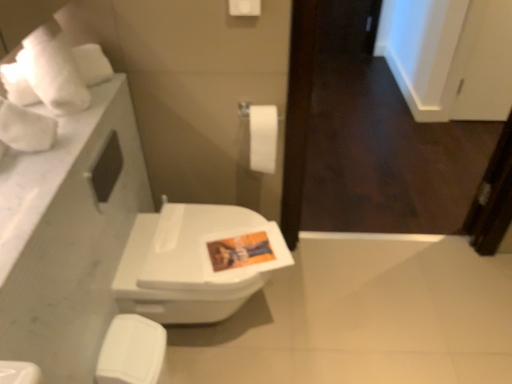
What is the approximate height of white matte toilet paper at center?

white matte toilet paper at center is 11.52 inches in height.

Image resolution: width=512 pixels, height=384 pixels. What do you see at coordinates (263, 137) in the screenshot?
I see `white matte toilet paper at center` at bounding box center [263, 137].

Image resolution: width=512 pixels, height=384 pixels. What do you see at coordinates (132, 351) in the screenshot?
I see `white glossy toilet seat at lower left` at bounding box center [132, 351].

Where is `white matte toilet paper at center`? The image size is (512, 384). white matte toilet paper at center is located at coordinates (263, 137).

Does white matte toilet paper at center have a greater height compared to white glossy toilet at center?

Incorrect, the height of white matte toilet paper at center is not larger of that of white glossy toilet at center.

Based on the photo, is white matte toilet paper at center positioned before white glossy toilet at center?

No, the depth of white matte toilet paper at center is greater than that of white glossy toilet at center.

What's the angular difference between white matte toilet paper at center and white glossy toilet at center's facing directions?

89.8 degrees separate the facing orientations of white matte toilet paper at center and white glossy toilet at center.

This screenshot has width=512, height=384. Identify the location of toilet paper that appears on the right of white glossy toilet seat at lower left. (263, 137).

Is white matte toilet paper at center positioned with its back to white glossy toilet seat at lower left?

No, white matte toilet paper at center is not facing away from white glossy toilet seat at lower left.

Considering the sizes of objects white matte toilet paper at center and white glossy toilet seat at lower left in the image provided, who is thinner, white matte toilet paper at center or white glossy toilet seat at lower left?

white matte toilet paper at center.

Is white glossy toilet seat at lower left completely or partially inside white matte toilet paper at center?

Answer: No, white matte toilet paper at center does not contain white glossy toilet seat at lower left.

From the image's perspective, does white glossy toilet at center appear higher than white marble countertop at left?

No, from the image's perspective, white glossy toilet at center is not over white marble countertop at left.

I want to click on counter top in front of the white glossy toilet at center, so click(69, 235).

Does white glossy toilet at center have a greater height compared to white marble countertop at left?

Indeed, white glossy toilet at center has a greater height compared to white marble countertop at left.

Is white glossy toilet at center next to white marble countertop at left?

No, white glossy toilet at center is not with white marble countertop at left.

Is white marble countertop at left surrounding white matte toilet paper at center?

No, white matte toilet paper at center is not surrounded by white marble countertop at left.

From the image's perspective, which one is positioned higher, white marble countertop at left or white matte toilet paper at center?

From the image's view, white matte toilet paper at center is above.

In terms of height, does white marble countertop at left look taller or shorter compared to white matte toilet paper at center?

white marble countertop at left is shorter than white matte toilet paper at center.

Could you tell me if white marble countertop at left is turned towards white glossy toilet at center?

No.

Which of these two, white marble countertop at left or white glossy toilet at center, is wider?

white glossy toilet at center.

Identify the location of toilet behind the white marble countertop at left. Image resolution: width=512 pixels, height=384 pixels. (193, 263).

In the scene shown: Between white glossy toilet at center and white glossy toilet seat at lower left, which one has more height?

With more height is white glossy toilet at center.

Is white glossy toilet at center inside the boundaries of white glossy toilet seat at lower left, or outside?

white glossy toilet at center lies outside white glossy toilet seat at lower left.

From the image's perspective, who appears lower, white glossy toilet at center or white glossy toilet seat at lower left?

white glossy toilet seat at lower left, from the image's perspective.

Is white glossy toilet at center not close to white glossy toilet seat at lower left?

That's not correct — white glossy toilet at center is a little close to white glossy toilet seat at lower left.

Does point (139, 378) come behind point (174, 257)?

No, (139, 378) is in front of (174, 257).

This screenshot has height=384, width=512. Find the location of `toilet behind the white glossy toilet seat at lower left`. toilet behind the white glossy toilet seat at lower left is located at coordinates (193, 263).

Is white glossy toilet at center at the back of white glossy toilet seat at lower left?

white glossy toilet seat at lower left does not have its back to white glossy toilet at center.

Where is `toilet to the left of white matte toilet paper at center`? toilet to the left of white matte toilet paper at center is located at coordinates (193, 263).

Identify the location of porcelain below the white matte toilet paper at center (from the image's perspective). (132, 351).

Estimate the real-world distances between objects in this image. Which object is further from white glossy toilet seat at lower left, white matte toilet paper at center or white marble countertop at left?

Among the two, white matte toilet paper at center is located further to white glossy toilet seat at lower left.

Considering their positions, is white marble countertop at left positioned closer to white glossy toilet seat at lower left than white glossy toilet at center?

Among the two, white glossy toilet at center is located nearer to white glossy toilet seat at lower left.

Which object lies nearer to the anchor point white matte toilet paper at center, white marble countertop at left or white glossy toilet at center?

white glossy toilet at center.

Consider the image. Estimate the real-world distances between objects in this image. Which object is closer to white matte toilet paper at center, white glossy toilet seat at lower left or white glossy toilet at center?

The object closer to white matte toilet paper at center is white glossy toilet at center.

Based on their spatial positions, is white glossy toilet seat at lower left or white matte toilet paper at center closer to white marble countertop at left?

white glossy toilet seat at lower left lies closer to white marble countertop at left than the other object.

Estimate the real-world distances between objects in this image. Which object is closer to white glossy toilet at center, white marble countertop at left or white matte toilet paper at center?

white marble countertop at left is positioned closer to the anchor white glossy toilet at center.

Based on their spatial positions, is white glossy toilet seat at lower left or white glossy toilet at center closer to white marble countertop at left?

Based on the image, white glossy toilet at center appears to be nearer to white marble countertop at left.

Looking at this image, considering their positions, is white glossy toilet at center positioned further to white glossy toilet seat at lower left than white marble countertop at left?

white marble countertop at left lies further to white glossy toilet seat at lower left than the other object.

Locate an element on the screen. This screenshot has height=384, width=512. toilet that lies between white matte toilet paper at center and white glossy toilet seat at lower left from top to bottom is located at coordinates (193, 263).

The height and width of the screenshot is (384, 512). Identify the location of toilet located between white marble countertop at left and white matte toilet paper at center in the depth direction. (193, 263).

Where is `counter top that lies between white matte toilet paper at center and white glossy toilet seat at lower left from top to bottom`? counter top that lies between white matte toilet paper at center and white glossy toilet seat at lower left from top to bottom is located at coordinates (69, 235).

This screenshot has height=384, width=512. I want to click on toilet between white marble countertop at left and white glossy toilet seat at lower left in the vertical direction, so [193, 263].